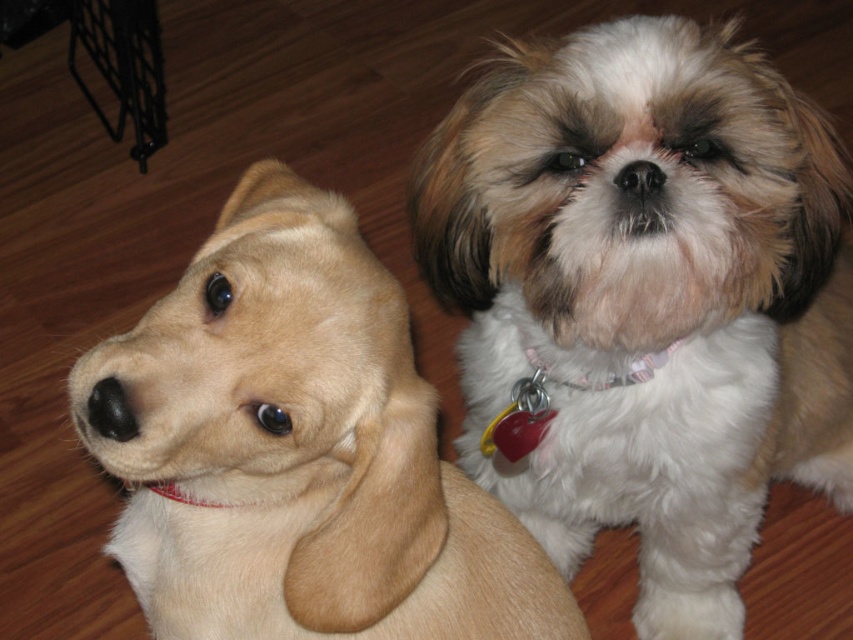
You are a photographer setting up a shoot in the room. You need to position a light source so that it illuminates the golden fur puppy at left without affecting the pink fabric neckband at center. Is this possible based on their positions?

The golden fur puppy at left is in front of the pink fabric neckband at center. Therefore, positioning a light source directly in front of the puppy would cast a shadow over the neckband, preventing light from reaching it. Alternatively, placing the light source to the side or above the puppy could illuminate it while avoiding the neckband.

You are a photographer trying to capture both the black smooth nose at left and the black fur nose at center in a single shot. Based on their positions, which nose will appear larger in the photo?

The black smooth nose at left is much taller than the black fur nose at center, so it will appear larger in the photo.

You are a photographer aiming to capture a closeup shot of the black smooth nose at left and the black fur nose at center. Since you want both noses in focus, which one should you adjust your camera focus to prioritize?

You should prioritize focusing on the black smooth nose at left because it is closer to the viewer, ensuring both will be in focus when using a shallow depth of field.